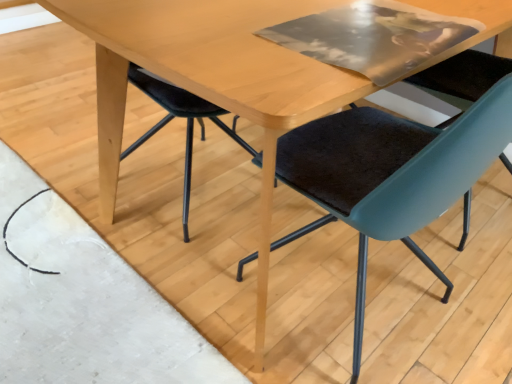
The width and height of the screenshot is (512, 384). Describe the element at coordinates (391, 175) in the screenshot. I see `teal plastic chair at right` at that location.

What are the coordinates of `teal plastic chair at right` in the screenshot? It's located at (391, 175).

You are a GUI agent. You are given a task and a screenshot of the screen. Output one action in this format:
    pyautogui.click(x=<x>, y=<y>)
    Task: Click on the teal plastic chair at right
    This screenshot has width=512, height=384.
    Given the screenshot: What is the action you would take?
    pyautogui.click(x=391, y=175)